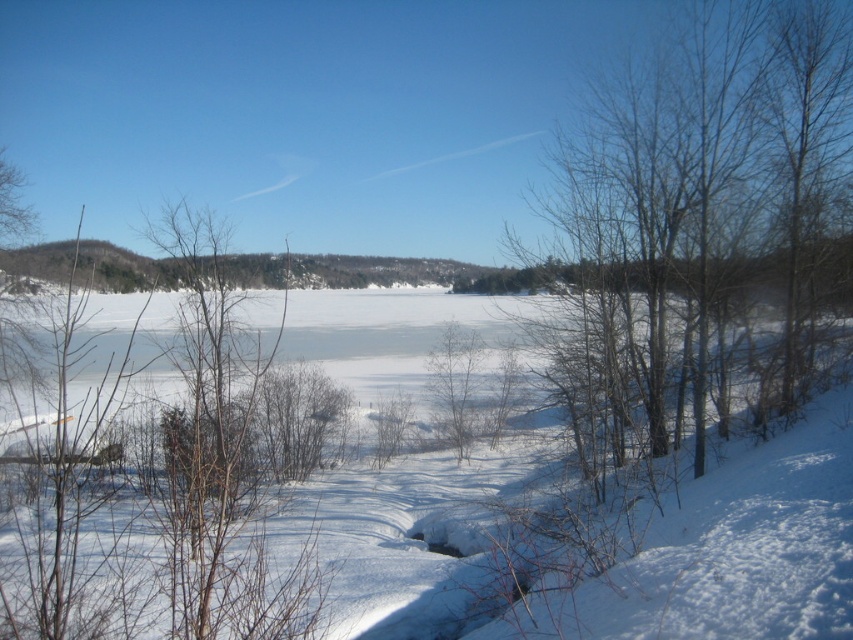
Is bare branches at right further to camera compared to white fluffy snow at center?

Yes.

Who is lower down, bare branches at right or white fluffy snow at center?

white fluffy snow at center is below.

You are a GUI agent. You are given a task and a screenshot of the screen. Output one action in this format:
    pyautogui.click(x=<x>, y=<y>)
    Task: Click on the bare branches at right
    This screenshot has height=640, width=853.
    Given the screenshot: What is the action you would take?
    pyautogui.click(x=701, y=221)

What are the coordinates of `bare branches at right` in the screenshot? It's located at (701, 221).